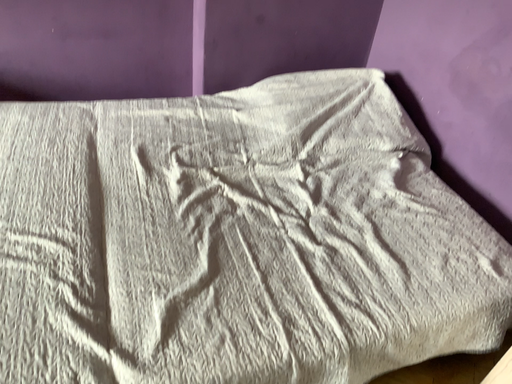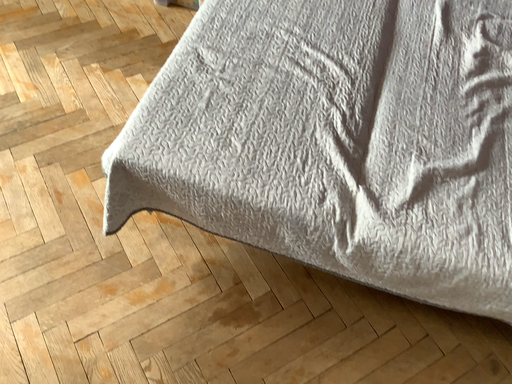
Question: Which way did the camera rotate in the video?

Choices:
 (A) rotated left
 (B) rotated right

Answer: (A)